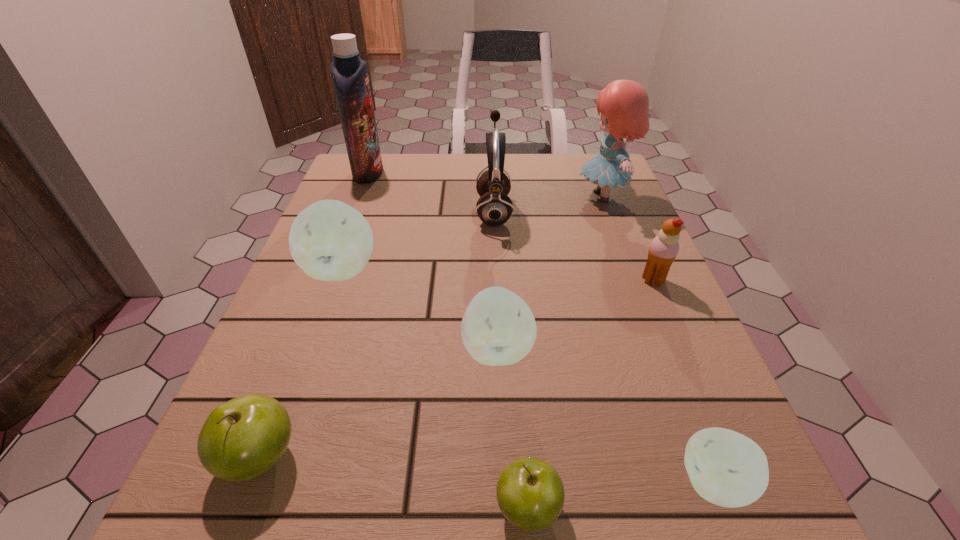
This screenshot has width=960, height=540. I want to click on vacant area that satisfies the following two spatial constraints: 1. on the front label of the farthest apple; 2. on the left side of the tallest object, so click(x=331, y=269).

Where is `free location that satisfies the following two spatial constraints: 1. on the ear pads of the nearest white apple; 2. on the right side of the brown earphone`? free location that satisfies the following two spatial constraints: 1. on the ear pads of the nearest white apple; 2. on the right side of the brown earphone is located at coordinates (505, 483).